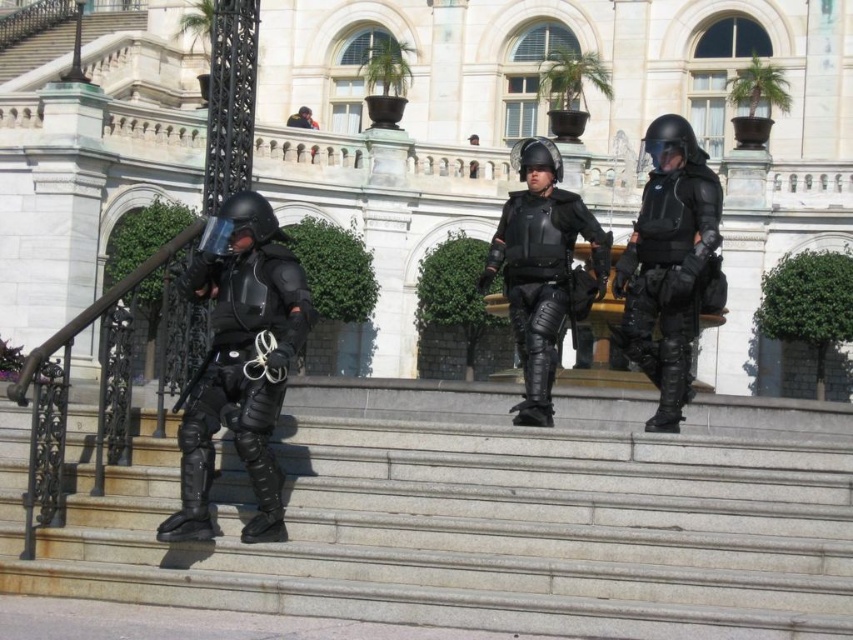
Which is in front, point (33, 60) or point (308, 124)?

Point (308, 124)

Identify the location of smooth stone stairs at upper center. (35, 51).

This screenshot has height=640, width=853. In order to click on smooth stone stairs at upper center in this screenshot , I will do `click(35, 51)`.

Who is shorter, matte black tactical suit at center or matte black armor at left?

With less height is matte black armor at left.

Where is `matte black tactical suit at center`? This screenshot has height=640, width=853. matte black tactical suit at center is located at coordinates (668, 268).

Identify the location of matte black tactical suit at center. (668, 268).

Is gray stone stairs at center smaller than matte black tactical suit at center?

Actually, gray stone stairs at center might be larger than matte black tactical suit at center.

Who is more forward, (361,531) or (619,269)?

Point (361,531) is in front.

Measure the distance between point (525, 604) and camera.

Point (525, 604) is 18.59 meters away from camera.

At what (x,y) coordinates should I click in order to perform the action: click on gray stone stairs at center. Please return your answer as a coordinate pair (x, y). Image resolution: width=853 pixels, height=640 pixels. Looking at the image, I should click on (480, 518).